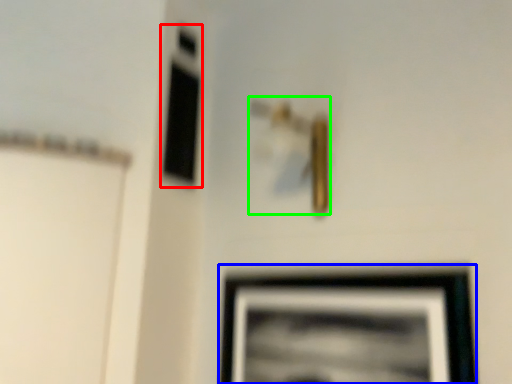
Question: Based on their relative distances, which object is farther from window (highlighted by a red box)? Choose from picture frame (highlighted by a blue box) and door handle (highlighted by a green box).

Choices:
 (A) picture frame
 (B) door handle

Answer: (A)